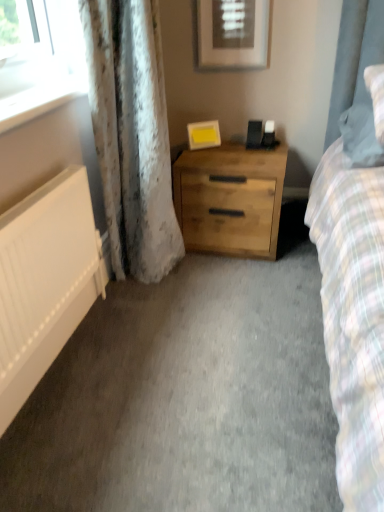
Question: From the image's perspective, is matte white picture frame at upper center, the 2th picture frame positioned from the bottom, on natural wood chest of drawers at center?

Choices:
 (A) yes
 (B) no

Answer: (A)

Question: From a real-world perspective, is matte white picture frame at upper center, the 2th picture frame positioned from the bottom, on natural wood chest of drawers at center?

Choices:
 (A) no
 (B) yes

Answer: (B)

Question: Are matte white picture frame at upper center, the 2th picture frame positioned from the bottom, and natural wood chest of drawers at center making contact?

Choices:
 (A) yes
 (B) no

Answer: (B)

Question: Can you confirm if matte white picture frame at upper center, the 2th picture frame positioned from the bottom, is thinner than natural wood chest of drawers at center?

Choices:
 (A) yes
 (B) no

Answer: (A)

Question: Does matte white picture frame at upper center, which appears as the 1th picture frame when viewed from the top, have a lesser height compared to natural wood chest of drawers at center?

Choices:
 (A) yes
 (B) no

Answer: (A)

Question: Looking at the image, does matte white picture frame at upper center, the 2th picture frame positioned from the bottom, seem bigger or smaller compared to natural wood chest of drawers at center?

Choices:
 (A) big
 (B) small

Answer: (B)

Question: Considering the positions of point (259, 23) and point (246, 181), is point (259, 23) closer or farther from the camera than point (246, 181)?

Choices:
 (A) farther
 (B) closer

Answer: (A)

Question: From a real-world perspective, is matte white picture frame at upper center, which appears as the 1th picture frame when viewed from the top, positioned above or below natural wood chest of drawers at center?

Choices:
 (A) below
 (B) above

Answer: (B)

Question: From the image's perspective, is matte white picture frame at upper center, which appears as the 1th picture frame when viewed from the top, located above or below natural wood chest of drawers at center?

Choices:
 (A) below
 (B) above

Answer: (B)

Question: Is white matte radiator at left spatially inside fluffy white pillow at right, or outside of it?

Choices:
 (A) inside
 (B) outside

Answer: (B)

Question: From a real-world perspective, is white matte radiator at left physically located above or below fluffy white pillow at right?

Choices:
 (A) below
 (B) above

Answer: (A)

Question: From the image's perspective, relative to fluffy white pillow at right, is white matte radiator at left above or below?

Choices:
 (A) below
 (B) above

Answer: (A)

Question: Relative to fluffy white pillow at right, is white matte radiator at left in front or behind?

Choices:
 (A) front
 (B) behind

Answer: (A)

Question: Considering the positions of matte white picture frame at upper center, which appears as the 1th picture frame when viewed from the top, and white textured curtain at left in the image, is matte white picture frame at upper center, which appears as the 1th picture frame when viewed from the top, taller or shorter than white textured curtain at left?

Choices:
 (A) tall
 (B) short

Answer: (B)

Question: From the image's perspective, is matte white picture frame at upper center, the 2th picture frame positioned from the bottom, positioned above or below white textured curtain at left?

Choices:
 (A) above
 (B) below

Answer: (A)